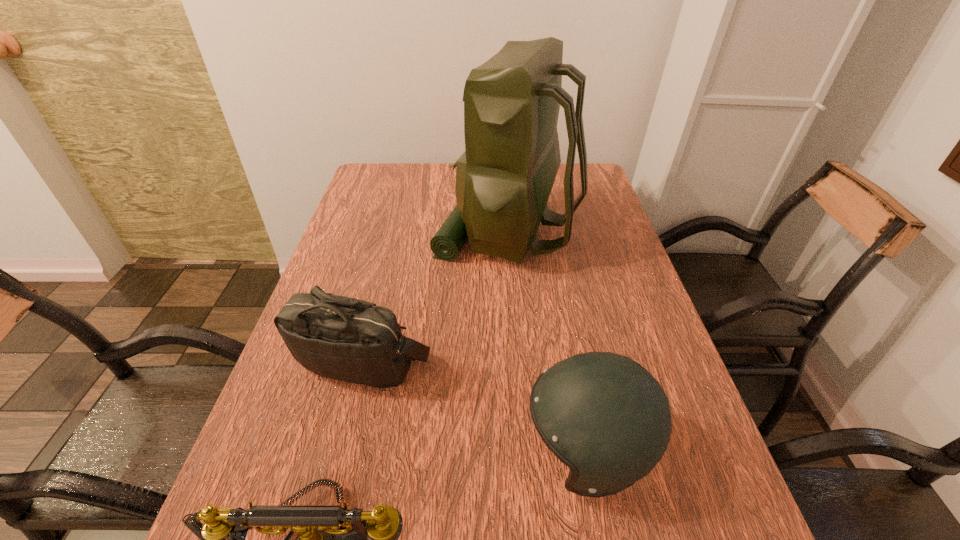
In order to click on the farthest object in this screenshot , I will do point(504,178).

At what (x,y) coordinates should I click in order to perform the action: click on backpack. Please return your answer as a coordinate pair (x, y). This screenshot has height=540, width=960. Looking at the image, I should click on (504, 178).

Find the location of a particular element. football helmet is located at coordinates (603, 415).

Locate an element on the screen. This screenshot has width=960, height=540. shoulder bag is located at coordinates (356, 341).

This screenshot has width=960, height=540. In order to click on vacant space located 0.260m on the front of the backpack with visible pockets in this screenshot , I will do `click(348, 232)`.

This screenshot has height=540, width=960. In order to click on blank space located 0.190m on the front of the backpack with visible pockets in this screenshot , I will do `click(371, 232)`.

What are the coordinates of `free space located on the front of the backpack with visible pockets` in the screenshot? It's located at (381, 232).

At what (x,y) coordinates should I click in order to perform the action: click on vacant area situated at the face opening of the football helmet. Please return your answer as a coordinate pair (x, y). The width and height of the screenshot is (960, 540). Looking at the image, I should click on (347, 451).

The height and width of the screenshot is (540, 960). I want to click on free space located at the face opening of the football helmet, so click(308, 451).

Identify the location of vacant space located 0.050m at the face opening of the football helmet. The height and width of the screenshot is (540, 960). (496, 451).